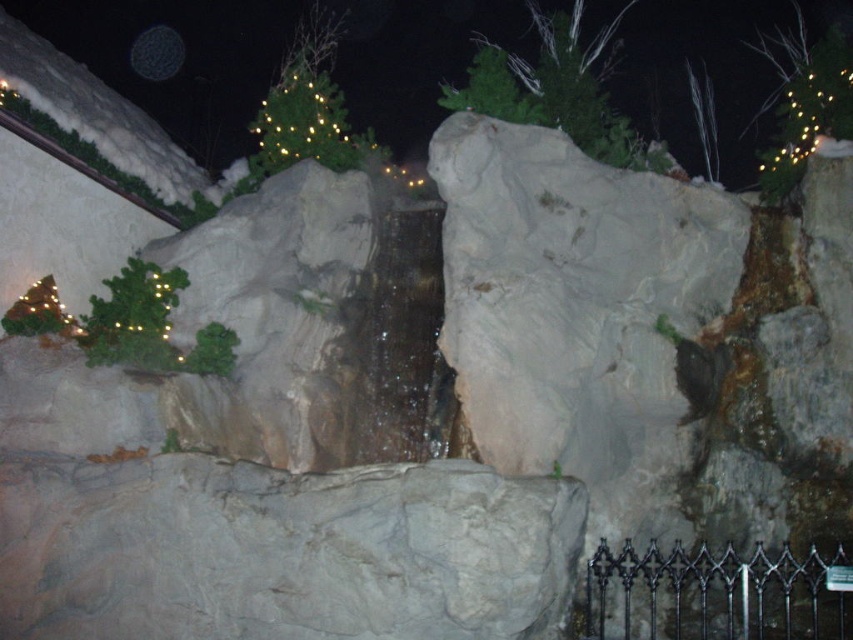
Question: Is green matte tree at upper center positioned at the back of illuminated wire at upper right?

Choices:
 (A) yes
 (B) no

Answer: (B)

Question: Which object is farther from the camera taking this photo?

Choices:
 (A) illuminated wire at upper right
 (B) green matte christmas tree at upper center

Answer: (B)

Question: Can you confirm if green matte tree at upper center is bigger than green matte christmas tree at upper center?

Choices:
 (A) yes
 (B) no

Answer: (B)

Question: Considering the relative positions of green matte tree at upper center and green matte christmas tree at upper center in the image provided, where is green matte tree at upper center located with respect to green matte christmas tree at upper center?

Choices:
 (A) below
 (B) above

Answer: (A)

Question: Considering the real-world distances, which object is closest to the green matte christmas tree at upper center?

Choices:
 (A) illuminated wire at upper right
 (B) green matte tree at upper center

Answer: (B)

Question: Estimate the real-world distances between objects in this image. Which object is closer to the green matte christmas tree at upper center?

Choices:
 (A) green matte tree at upper center
 (B) illuminated wire at upper right

Answer: (A)